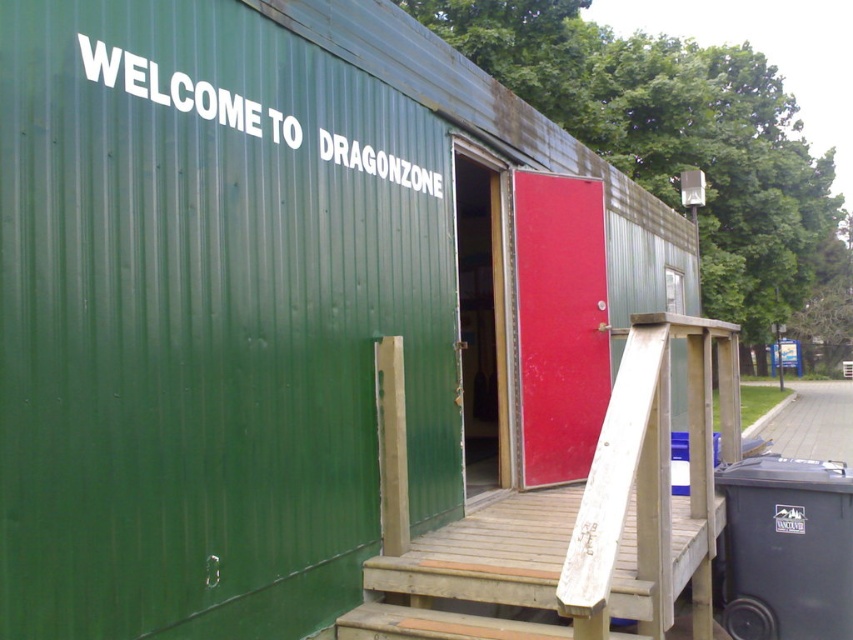
Between red matte door at center and matte black trash can at lower right, which one is positioned higher?

red matte door at center is higher up.

Who is more distant from viewer, (x=531, y=189) or (x=787, y=584)?

Point (x=531, y=189)

Where is `red matte door at center`? This screenshot has width=853, height=640. red matte door at center is located at coordinates (560, 323).

Locate an element on the screen. Image resolution: width=853 pixels, height=640 pixels. matte black trash can at lower right is located at coordinates (787, 548).

Is matte black trash can at lower right wider than green wooden door at center?

Indeed, matte black trash can at lower right has a greater width compared to green wooden door at center.

Is point (805, 504) less distant than point (457, 305)?

Yes, it is.

Image resolution: width=853 pixels, height=640 pixels. I want to click on matte black trash can at lower right, so click(x=787, y=548).

Is red matte door at center to the left of green wooden door at center from the viewer's perspective?

In fact, red matte door at center is to the right of green wooden door at center.

Is point (595, 212) closer to camera compared to point (492, 211)?

No.

This screenshot has height=640, width=853. What do you see at coordinates (560, 323) in the screenshot? I see `red matte door at center` at bounding box center [560, 323].

Image resolution: width=853 pixels, height=640 pixels. What are the coordinates of `red matte door at center` in the screenshot? It's located at (560, 323).